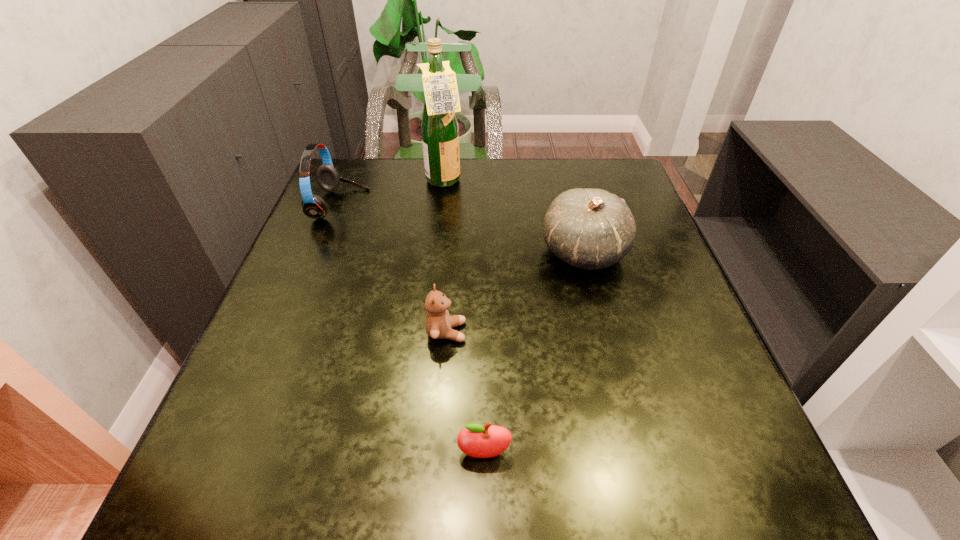
Where is `vacant area between the gourd and the teddy bear`? The width and height of the screenshot is (960, 540). vacant area between the gourd and the teddy bear is located at coordinates (516, 292).

You are a GUI agent. You are given a task and a screenshot of the screen. Output one action in this format:
    pyautogui.click(x=<x>, y=<y>)
    Task: Click on the object that stands as the second closest to the shortest object
    The width and height of the screenshot is (960, 540).
    Given the screenshot: What is the action you would take?
    pyautogui.click(x=591, y=229)

What are the coordinates of `object that can be found as the second closest to the leftmost object` in the screenshot? It's located at (439, 324).

Find the location of a particular element. The image size is (960, 540). free space that satisfies the following two spatial constraints: 1. on the front-facing side of the rightmost object; 2. on the left side of the liquor is located at coordinates (437, 252).

Where is `vacant region that satisfies the following two spatial constraints: 1. with the microphone attached to the side of the headset; 2. on the right side of the apple`? This screenshot has width=960, height=540. vacant region that satisfies the following two spatial constraints: 1. with the microphone attached to the side of the headset; 2. on the right side of the apple is located at coordinates (242, 453).

The width and height of the screenshot is (960, 540). Identify the location of vacant space that satisfies the following two spatial constraints: 1. on the front-facing side of the nearest object; 2. on the left side of the tallest object. (416, 453).

Where is `vacant region that satisfies the following two spatial constraints: 1. on the front-facing side of the shortest object; 2. on the left side of the liquor`? vacant region that satisfies the following two spatial constraints: 1. on the front-facing side of the shortest object; 2. on the left side of the liquor is located at coordinates (416, 453).

You are a GUI agent. You are given a task and a screenshot of the screen. Output one action in this format:
    pyautogui.click(x=<x>, y=<y>)
    Task: Click on the vacant area in the image that satisfies the following two spatial constraints: 1. with the microphone attached to the side of the gourd; 2. on the left side of the leftmost object
    This screenshot has width=960, height=540.
    Given the screenshot: What is the action you would take?
    pyautogui.click(x=322, y=252)

This screenshot has width=960, height=540. What are the coordinates of `free point that satisfies the following two spatial constraints: 1. on the front-facing side of the nearest object; 2. on the right side of the tallest object` in the screenshot? It's located at (416, 453).

At what (x,y) coordinates should I click in order to perform the action: click on vacant position in the image that satisfies the following two spatial constraints: 1. on the front-facing side of the liquor; 2. on the left side of the nearest object. Please return your answer as a coordinate pair (x, y). Looking at the image, I should click on (416, 453).